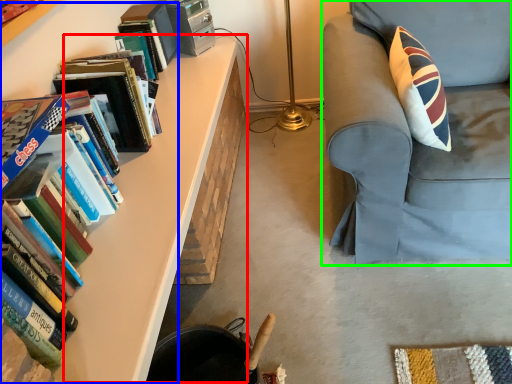
Question: Which object is the closest to the table (highlighted by a red box)? Choose among these: book (highlighted by a blue box) or chair (highlighted by a green box).

Choices:
 (A) book
 (B) chair

Answer: (A)